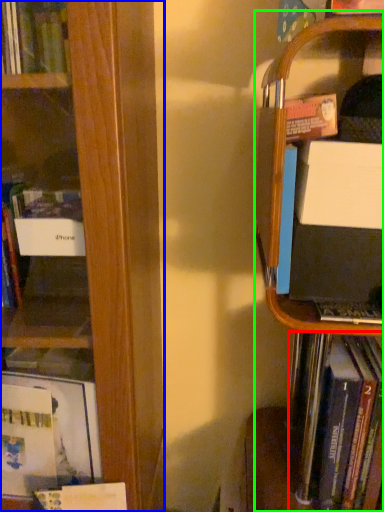
Question: Which object is positioned closest to book (highlighted by a red box)? Select from book (highlighted by a blue box) and bookshelf (highlighted by a green box).

Choices:
 (A) book
 (B) bookshelf

Answer: (B)